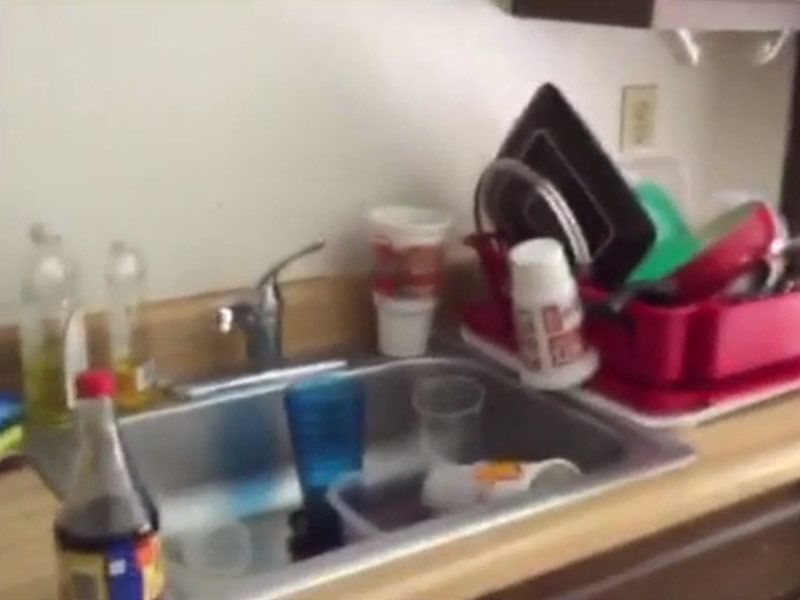
The width and height of the screenshot is (800, 600). I want to click on tall plastic cups, so click(x=414, y=265), click(x=540, y=315), click(x=502, y=480).